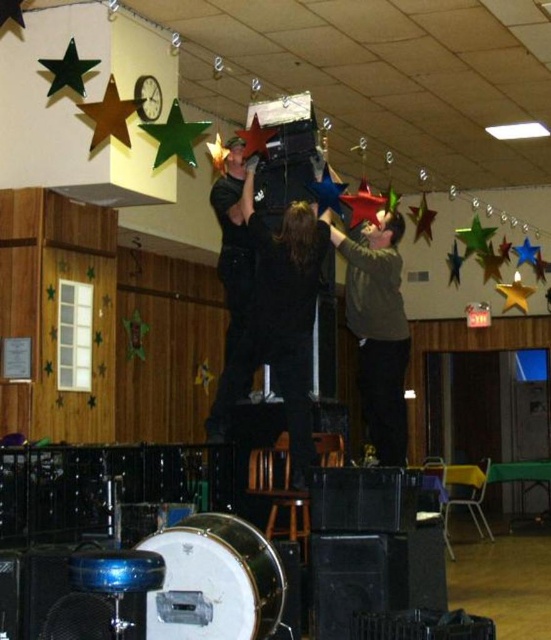
Question: Which point is farther from the camera taking this photo?

Choices:
 (A) (52, 72)
 (B) (527, 241)
 (C) (510, 282)

Answer: (C)

Question: Estimate the real-world distances between objects in this image. Which object is closer to the green matte shirt at upper center?

Choices:
 (A) metallic gold star at upper center
 (B) blue metallic star at upper center
 (C) gold metallic star at upper left
 (D) dark blue uniform at center

Answer: (D)

Question: Observing the image, what is the correct spatial positioning of green matte shirt at upper center in reference to dark blue uniform at center?

Choices:
 (A) below
 (B) above

Answer: (A)

Question: Does metallic green star at upper center appear on the right side of metallic gold star at upper right?

Choices:
 (A) yes
 (B) no

Answer: (B)

Question: Which point is closer to the camera?

Choices:
 (A) metallic green star at upper center
 (B) gold metallic star at upper left

Answer: (B)

Question: Does green matte shirt at upper center have a larger size compared to green glossy star at upper center?

Choices:
 (A) yes
 (B) no

Answer: (A)